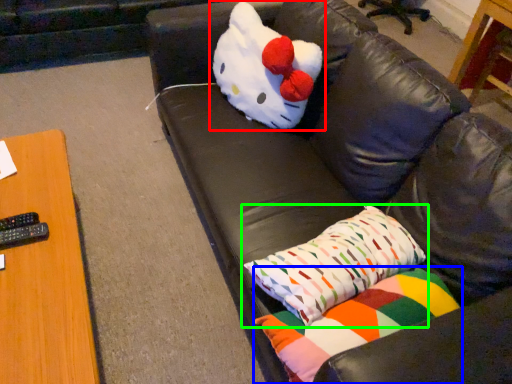
Question: Based on their relative distances, which object is nearer to toy (highlighted by a red box)? Choose from pillow (highlighted by a blue box) and pillow (highlighted by a green box).

Choices:
 (A) pillow
 (B) pillow

Answer: (B)